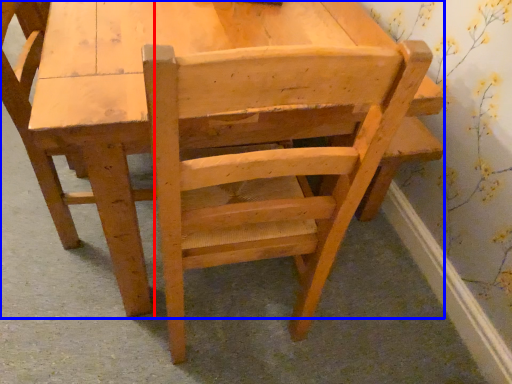
Question: Among these objects, which one is nearest to the camera, chair (highlighted by a red box) or chair (highlighted by a blue box)?

Choices:
 (A) chair
 (B) chair

Answer: (B)